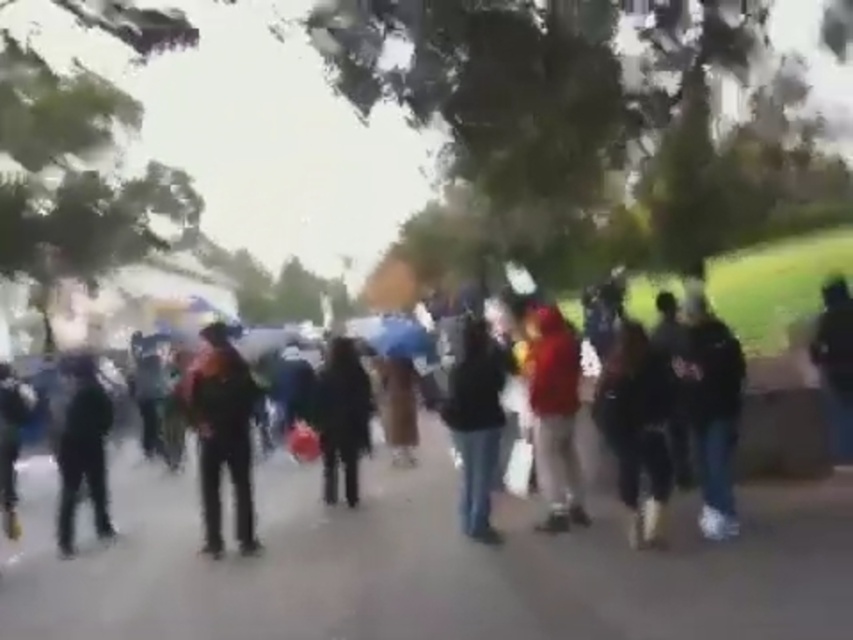
Question: Can you confirm if dark clothing crowd at center is positioned to the right of black matte jacket at center?

Choices:
 (A) yes
 (B) no

Answer: (A)

Question: Which point is farther to the camera?

Choices:
 (A) (67, 518)
 (B) (579, 627)
 (C) (473, 476)
 (D) (195, 408)

Answer: (A)

Question: Which point is farther to the camera?

Choices:
 (A) dark clothing crowd at center
 (B) black matte jacket at center
 (C) black matte jacket at left
 (D) dark blue jeans at center

Answer: (B)

Question: Is the position of dark clothing crowd at center less distant than that of black matte jacket at left?

Choices:
 (A) yes
 (B) no

Answer: (B)

Question: Estimate the real-world distances between objects in this image. Which object is closer to the dark clothing crowd at center?

Choices:
 (A) black matte jacket at center
 (B) dark brown leather jacket at left
 (C) dark blue jeans at center
 (D) gray concrete pavement at center

Answer: (C)

Question: Does gray concrete pavement at center appear on the left side of dark clothing crowd at center?

Choices:
 (A) yes
 (B) no

Answer: (A)